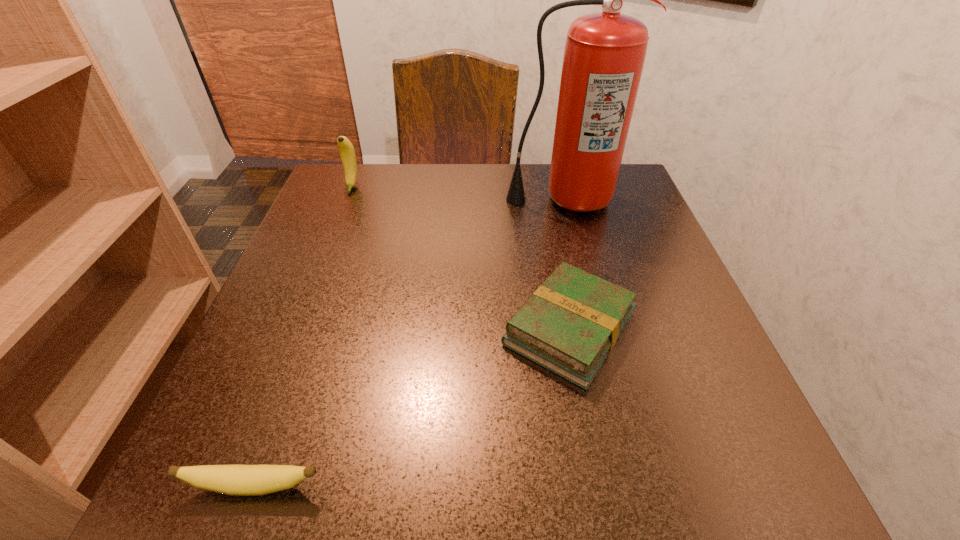
The image size is (960, 540). In order to click on fire extinguisher located at the far edge in this screenshot , I will do `click(604, 55)`.

The height and width of the screenshot is (540, 960). Find the location of `banana present at the far edge`. banana present at the far edge is located at coordinates (346, 149).

This screenshot has width=960, height=540. In order to click on object located at the near edge in this screenshot , I will do `click(237, 480)`.

Locate an element on the screen. The height and width of the screenshot is (540, 960). fire extinguisher that is positioned at the right edge is located at coordinates (604, 55).

You are a GUI agent. You are given a task and a screenshot of the screen. Output one action in this format:
    pyautogui.click(x=<x>, y=<y>)
    Task: Click on the book that is at the right edge
    The height and width of the screenshot is (540, 960).
    Given the screenshot: What is the action you would take?
    pyautogui.click(x=569, y=325)

This screenshot has height=540, width=960. Identify the location of object at the far left corner. pos(346,149).

Identify the location of object at the near left corner. (237, 480).

At what (x,y) coordinates should I click in order to perform the action: click on object that is at the far right corner. Please return your answer as a coordinate pair (x, y). Image resolution: width=960 pixels, height=540 pixels. Looking at the image, I should click on (604, 55).

Where is `free space at the far edge`? The width and height of the screenshot is (960, 540). free space at the far edge is located at coordinates (395, 195).

Find the location of `vacant space at the near edge of the desktop`. vacant space at the near edge of the desktop is located at coordinates (422, 483).